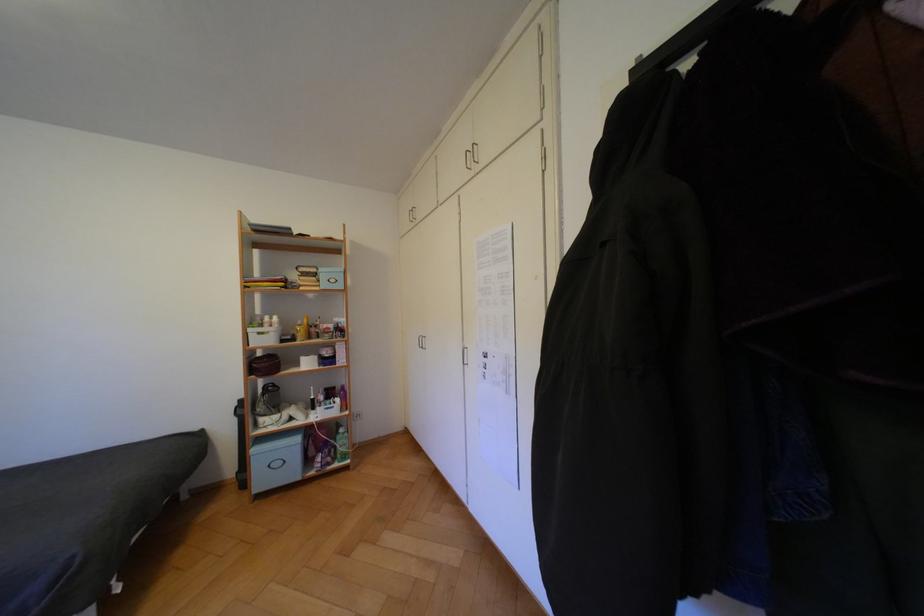
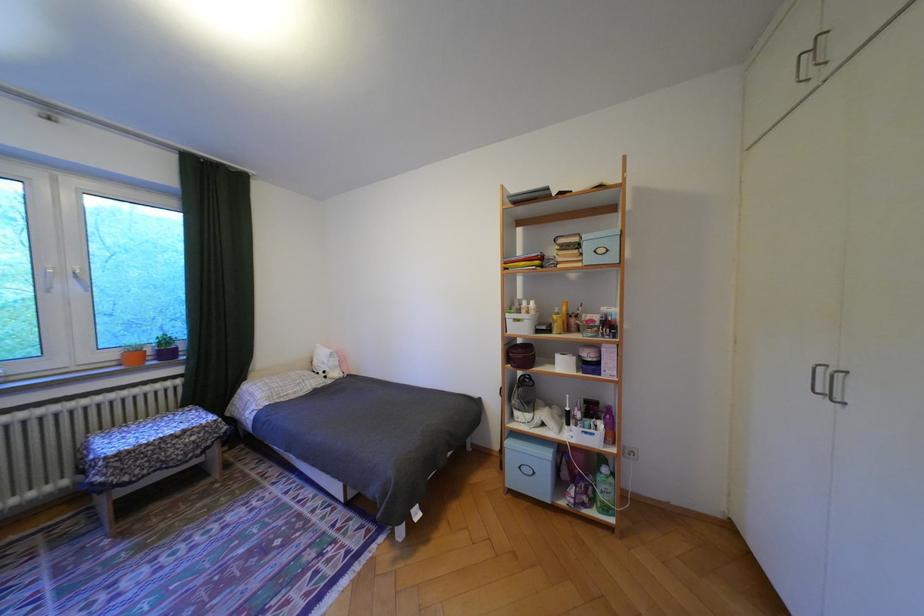
Find the pixel in the second image that matches [300,338] in the first image.

(555, 328)